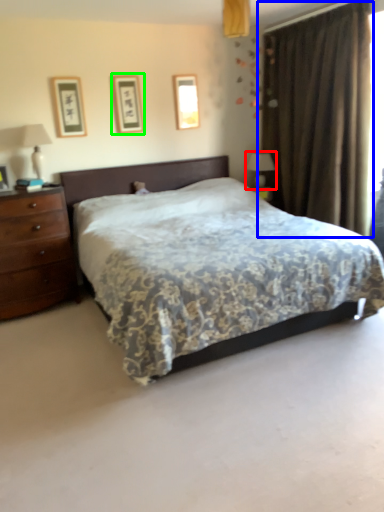
Question: Based on their relative distances, which object is nearer to table lamp (highlighted by a red box)? Choose from curtain (highlighted by a blue box) and picture frame (highlighted by a green box).

Choices:
 (A) curtain
 (B) picture frame

Answer: (A)